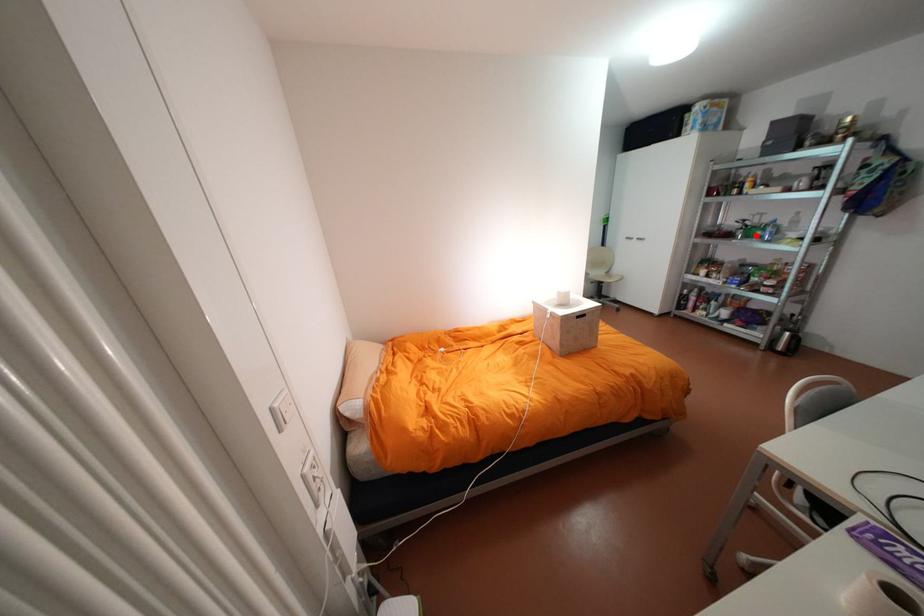
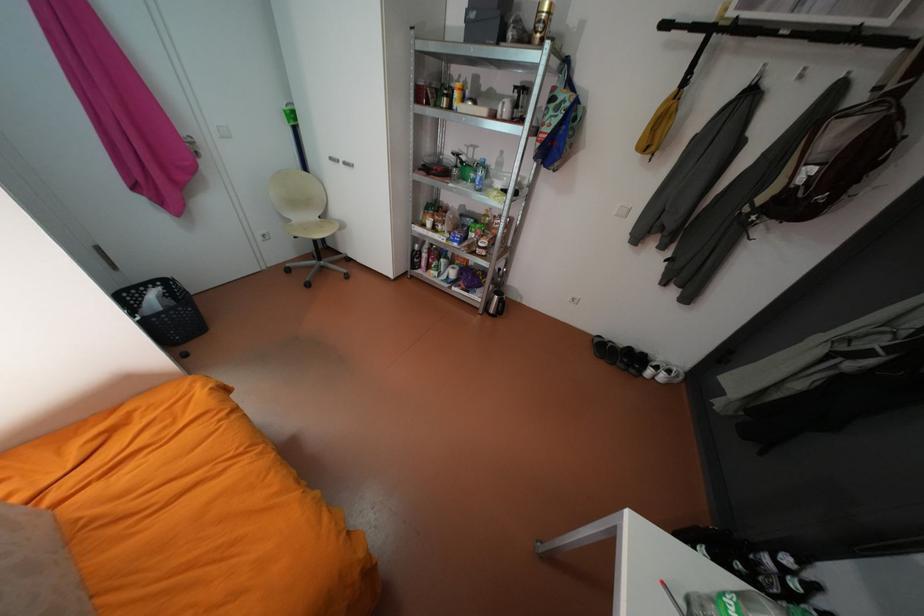
The point at the highlighted location is marked in the first image. Where is the corresponding point in the second image?

(471, 177)